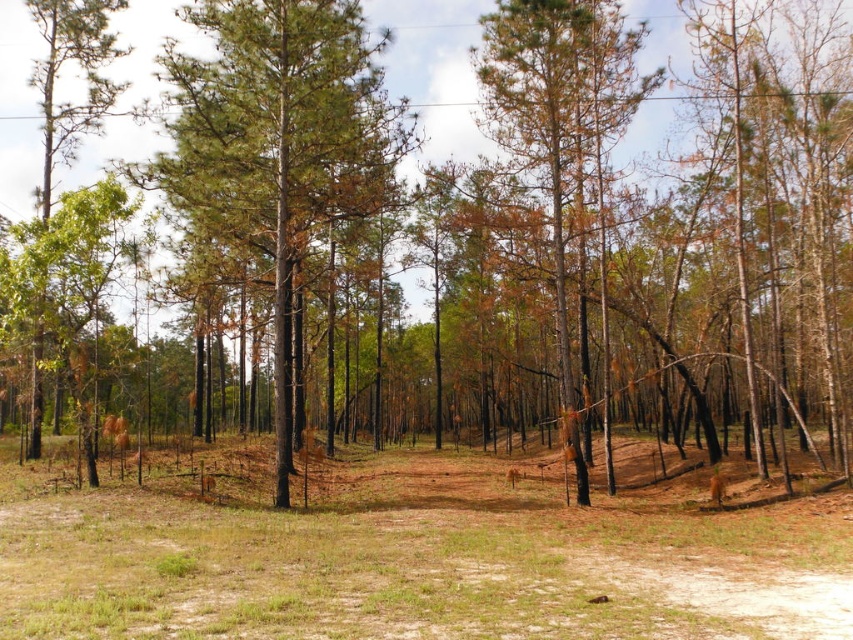
Question: Based on their relative distances, which object is farther from the green matte tree at center?

Choices:
 (A) brown bark tree at center
 (B) brown dirt field at center
 (C) green matte tree at left

Answer: (C)

Question: Which point is closer to the camera?

Choices:
 (A) (305, 560)
 (B) (32, 376)
 (C) (231, 227)

Answer: (A)

Question: Can you confirm if brown dirt field at center is positioned above green matte tree at center?

Choices:
 (A) yes
 (B) no

Answer: (B)

Question: Can you confirm if green matte tree at center is positioned below brown bark tree at center?

Choices:
 (A) no
 (B) yes

Answer: (B)

Question: Is brown dirt field at center further to the viewer compared to green matte tree at center?

Choices:
 (A) yes
 (B) no

Answer: (B)

Question: Which point is farther to the camera?

Choices:
 (A) brown dirt field at center
 (B) brown bark tree at center
 (C) green matte tree at center
 (D) green matte tree at left

Answer: (B)